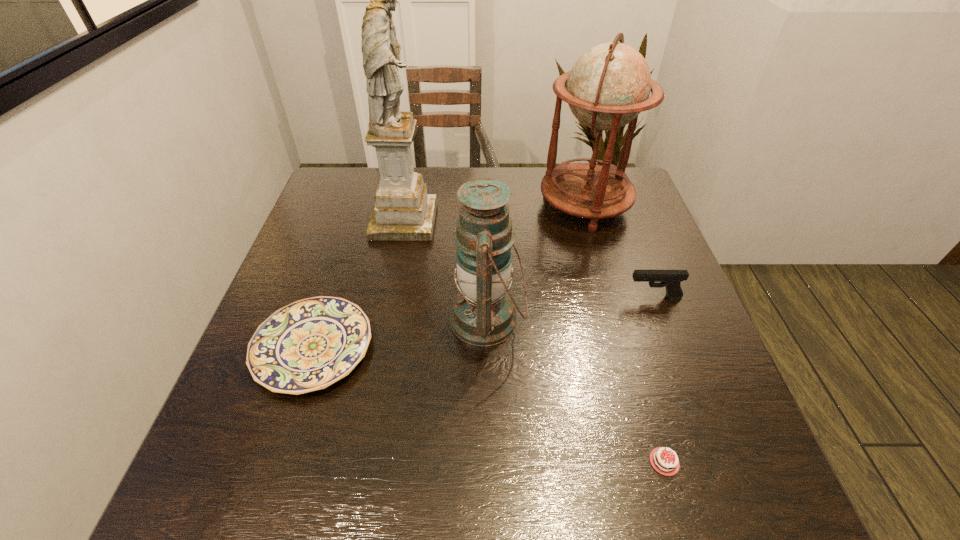
Identify the location of object situated at the left edge. (308, 345).

At what (x,y) coordinates should I click in order to perform the action: click on globe present at the right edge. Please return your answer as a coordinate pair (x, y). Looking at the image, I should click on (609, 85).

Where is `pistol present at the right edge`? pistol present at the right edge is located at coordinates (670, 279).

Locate an element on the screen. The height and width of the screenshot is (540, 960). chocolate cake situated at the right edge is located at coordinates (660, 458).

Find the location of a particular element. The height and width of the screenshot is (540, 960). object at the far right corner is located at coordinates (609, 85).

I want to click on object present at the near right corner, so click(660, 458).

At what (x,y) coordinates should I click in order to perform the action: click on vacant space at the near edge of the desktop. Please return your answer as a coordinate pair (x, y). Looking at the image, I should click on pyautogui.click(x=549, y=469).

This screenshot has height=540, width=960. In order to click on free space at the left edge in this screenshot , I will do `click(311, 276)`.

Identify the location of vacant position at the right edge of the desktop. The width and height of the screenshot is (960, 540). (684, 331).

At what (x,y) coordinates should I click in order to perform the action: click on vacant area at the far left corner. Please return your answer as a coordinate pair (x, y). The image size is (960, 540). Looking at the image, I should click on pos(363,186).